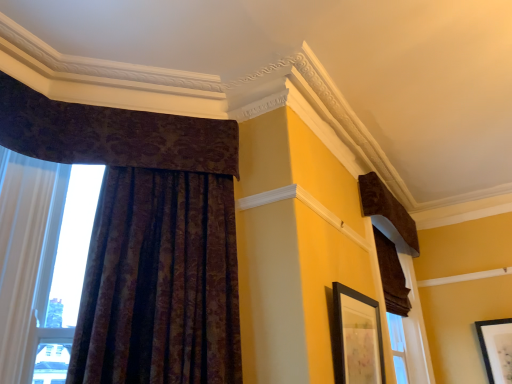
Question: From a real-world perspective, is brown velvet curtain at right, the second curtain in the right-to-left sequence, positioned above or below dark velvet curtain at upper left, the second curtain when ordered from left to right?

Choices:
 (A) below
 (B) above

Answer: (A)

Question: Is point (395, 263) positioned closer to the camera than point (195, 165)?

Choices:
 (A) closer
 (B) farther

Answer: (B)

Question: Considering the real-world distances, which object is closest to the matte black picture frame at upper right, the 2th picture frame viewed from the front?

Choices:
 (A) brown velvet curtain at right, which ranks as the 3th curtain in left-to-right order
 (B) velvet brown curtain at upper right, marked as the first curtain in a right-to-left arrangement
 (C) dark velvet curtain at upper left, which is counted as the third curtain, starting from the right
 (D) black matte picture frame at center, the second picture frame when ordered from back to front
 (E) velvet-like brown curtain at left, the 4th curtain when ordered from right to left

Answer: (A)

Question: Based on their relative distances, which object is nearer to the brown velvet curtain at right, the second curtain in the right-to-left sequence?

Choices:
 (A) dark velvet curtain at upper left, which is counted as the third curtain, starting from the right
 (B) velvet brown curtain at upper right, which is counted as the 4th curtain, starting from the left
 (C) matte black picture frame at upper right, the 1th picture frame viewed from the right
 (D) velvet-like brown curtain at left, which appears as the first curtain when viewed from the left
 (E) black matte picture frame at center, the second picture frame positioned from the bottom

Answer: (B)